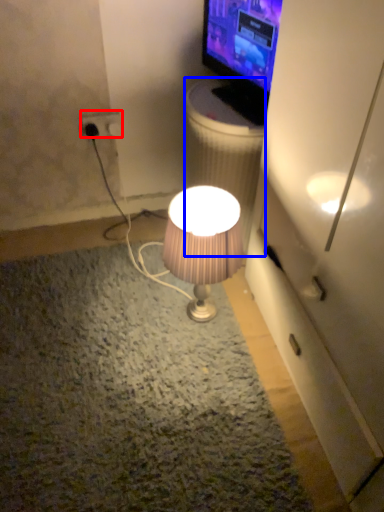
Question: Which object is closer to the camera taking this photo, power outlet (highlighted by a red box) or trash bin/can (highlighted by a blue box)?

Choices:
 (A) power outlet
 (B) trash bin/can

Answer: (B)